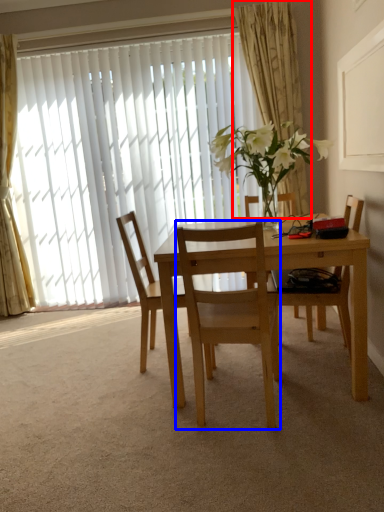
Question: Which object appears closest to the camera in this image, curtain (highlighted by a red box) or chair (highlighted by a blue box)?

Choices:
 (A) curtain
 (B) chair

Answer: (B)